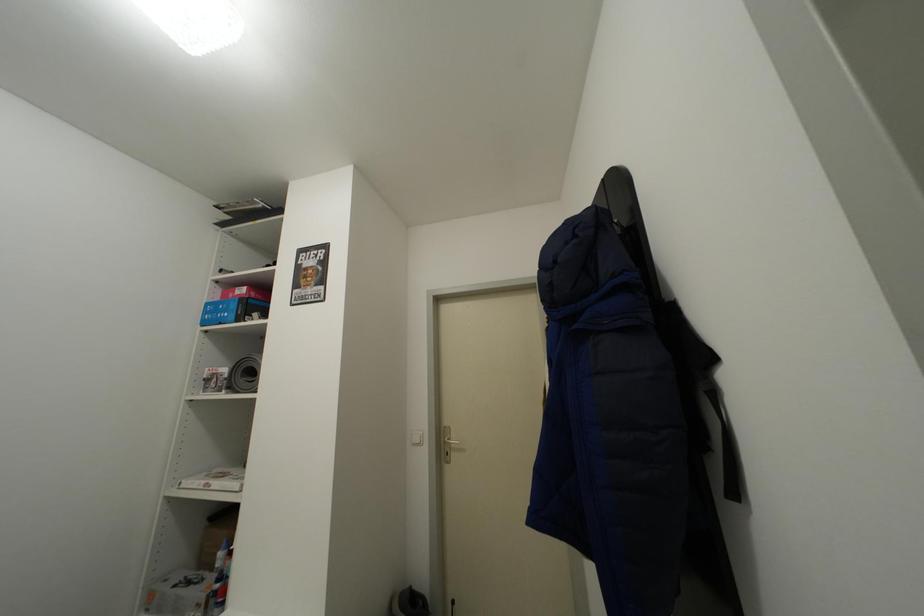
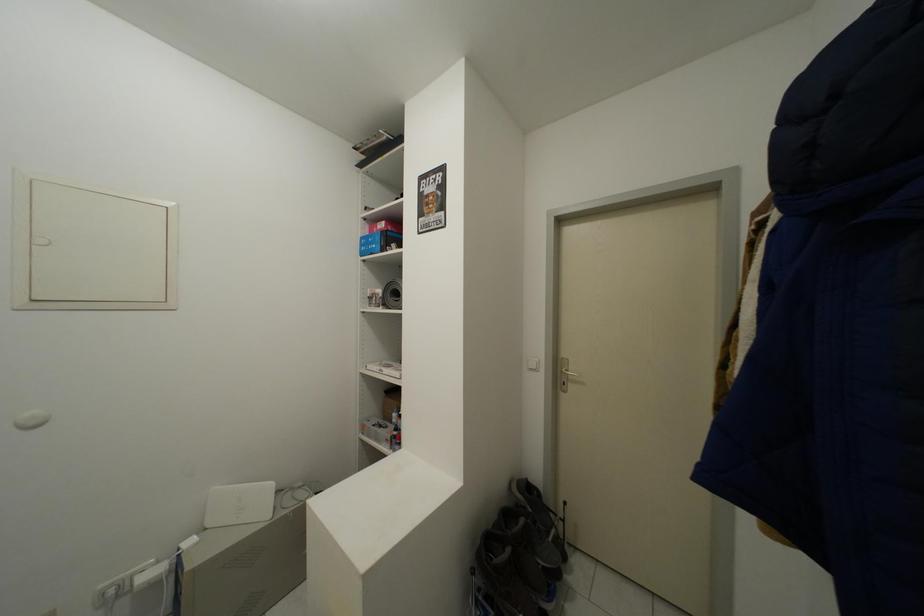
Question: Based on the continuous images, in which direction is the camera rotating? Reply with the corresponding letter.

Choices:
 (A) Left
 (B) Right
 (C) Up
 (D) Down

Answer: (A)